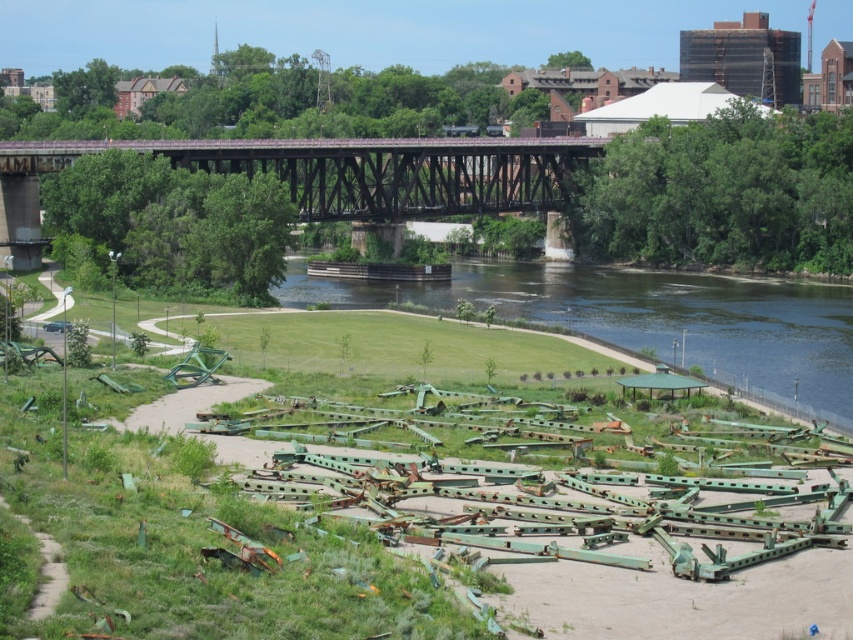
Question: Is green grass at lower center above rusty metal bridge at upper center?

Choices:
 (A) yes
 (B) no

Answer: (B)

Question: Which point appears closest to the camera in this image?

Choices:
 (A) (593, 312)
 (B) (370, 157)

Answer: (A)

Question: Among these points, which one is farthest from the camera?

Choices:
 (A) (183, 154)
 (B) (799, 296)

Answer: (B)

Question: Is green grass at lower center above rusty metal bridge at upper center?

Choices:
 (A) yes
 (B) no

Answer: (B)

Question: Can you confirm if green grass at lower center is positioned above rusty metal bridge at upper center?

Choices:
 (A) yes
 (B) no

Answer: (B)

Question: Which object appears closest to the camera in this image?

Choices:
 (A) rusty metal bridge at upper center
 (B) green grass at lower center

Answer: (B)